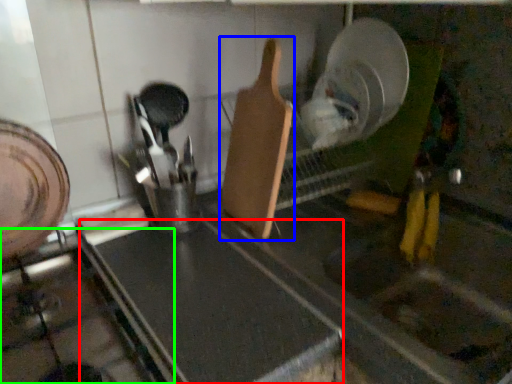
Question: Estimate the real-world distances between objects in this image. Which object is farther from counter top (highlighted by a red box), spatula (highlighted by a blue box) or gas stove (highlighted by a green box)?

Choices:
 (A) spatula
 (B) gas stove

Answer: (A)